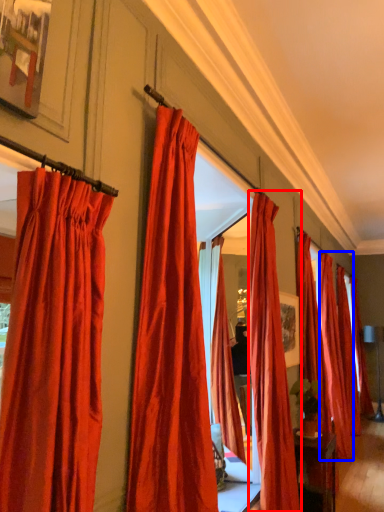
Question: Among these objects, which one is nearest to the camera, curtain (highlighted by a red box) or curtain (highlighted by a blue box)?

Choices:
 (A) curtain
 (B) curtain

Answer: (A)